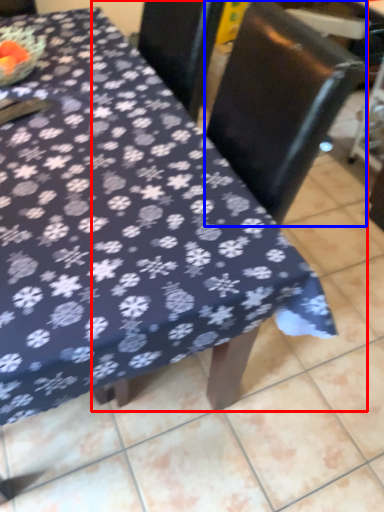
Question: Among these objects, which one is farthest to the camera, chair (highlighted by a red box) or swivel chair (highlighted by a blue box)?

Choices:
 (A) chair
 (B) swivel chair

Answer: (B)